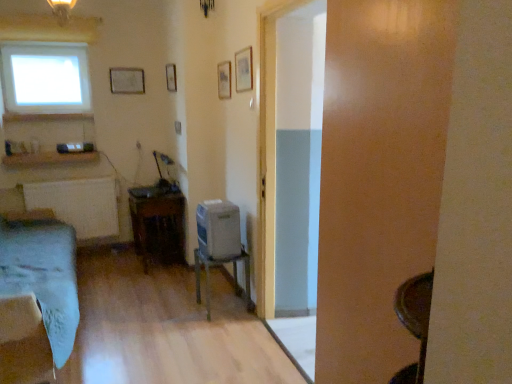
At what (x,y) coordinates should I click in order to perform the action: click on vacant area on top of white matte radiator at left (from a real-world perspective). Please return your answer as a coordinate pair (x, y). This screenshot has width=512, height=384. Looking at the image, I should click on (88, 176).